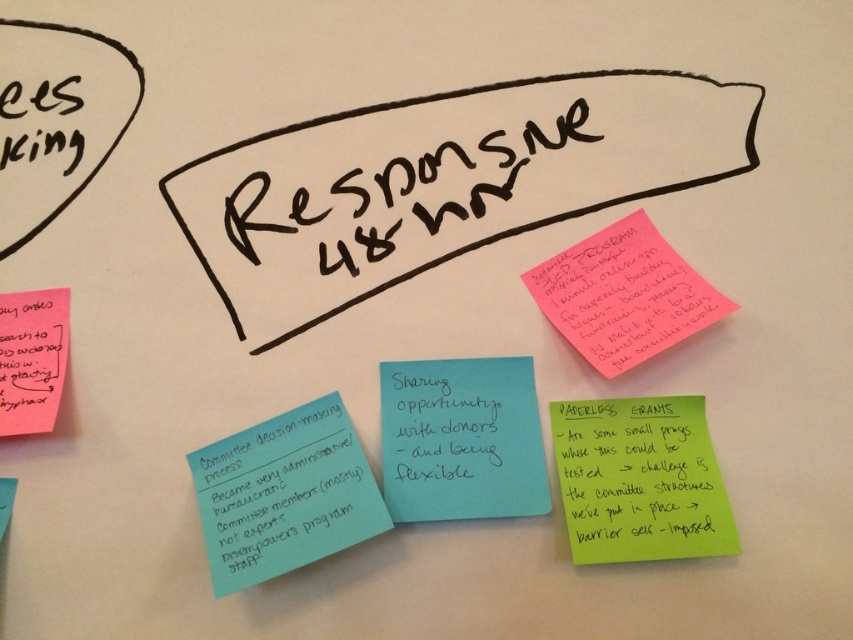
You are an office worker who needs to attach a new sticky note to the whiteboard. You have two options for placement based on the existing sticky notes. The green paper at lower right and the pink paper at upper right. Which of these two locations has a wider sticky note?

The pink paper at upper right has a wider sticky note than the green paper at lower right.

Which object is located at the point with coordinates (639,481)?

The green paper at lower right is located at the point with coordinates (639,481).